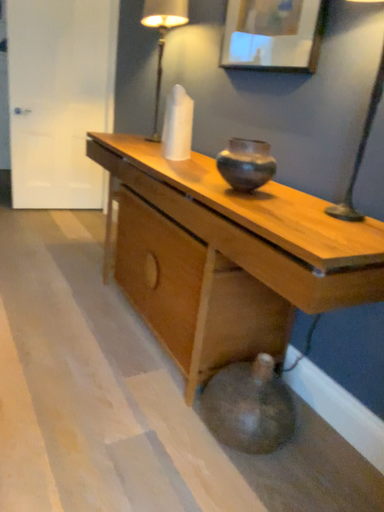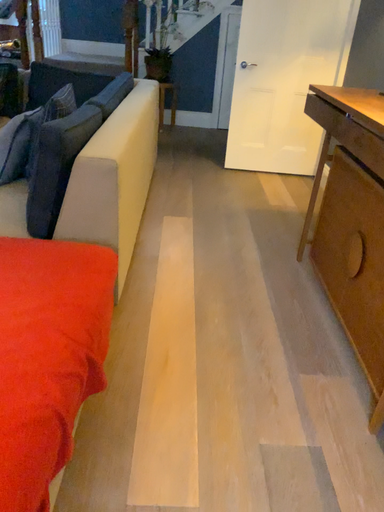
Question: How did the camera likely rotate when shooting the video?

Choices:
 (A) rotated left
 (B) rotated right

Answer: (A)